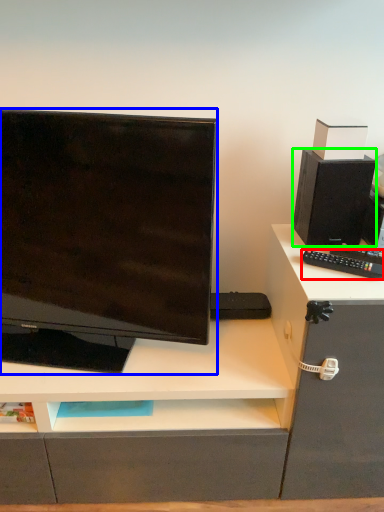
Question: Considering the real-world distances, which object is closest to remote control (highlighted by a red box)? computer monitor (highlighted by a blue box) or speaker (highlighted by a green box).

Choices:
 (A) computer monitor
 (B) speaker

Answer: (B)